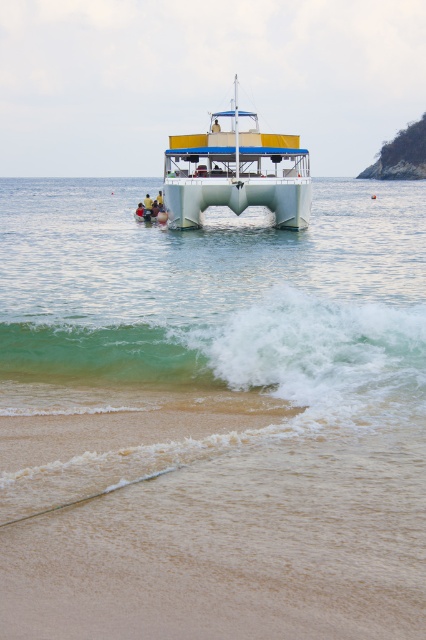
You are a photographer standing on the sandy beach at lower center and want to take a photo of the white plastic boat at center. Based on your position, which direction should you look to capture the boat in your shot?

The sandy beach at lower center is below the white plastic boat at center, so you should look upward to capture the boat in your shot.

You are a photographer planning to capture the sandy beach at lower center and the green translucent water at lower center in a single shot. Based on their sizes, which one will occupy more of the frame?

The sandy beach at lower center occupies more of the frame since it has a larger size compared to the green translucent water at lower center.